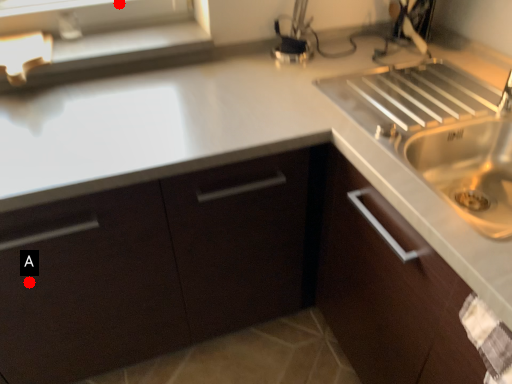
Question: Two points are circled on the image, labeled by A and B beside each circle. Which point is closer to the camera taking this photo?

Choices:
 (A) A is closer
 (B) B is closer

Answer: (A)